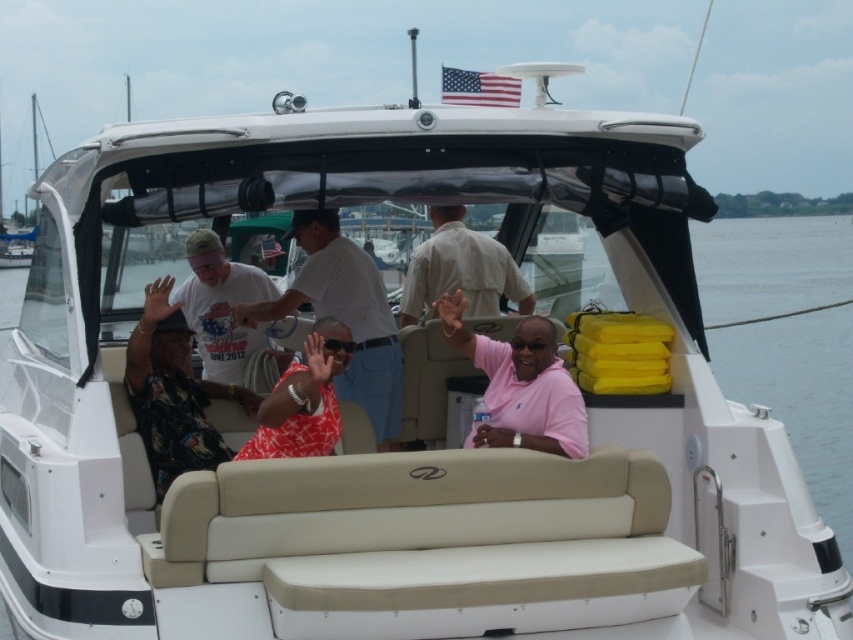
Can you confirm if white t-shirt at center is positioned to the left of red printed shirt at center?

Correct, you'll find white t-shirt at center to the left of red printed shirt at center.

What do you see at coordinates (223, 308) in the screenshot? I see `white t-shirt at center` at bounding box center [223, 308].

Find the location of a particular element. The width and height of the screenshot is (853, 640). white t-shirt at center is located at coordinates (223, 308).

Is printed fabric shirt at left smaller than white t-shirt at center?

Actually, printed fabric shirt at left might be larger than white t-shirt at center.

Find the location of a particular element. This screenshot has width=853, height=640. printed fabric shirt at left is located at coordinates (173, 392).

Who is more forward, (160, 305) or (218, 284)?

Point (160, 305)

Identify the location of printed fabric shirt at left. (173, 392).

From the picture: Is yellow foam at right smaller than white cotton shirt at center?

Incorrect, yellow foam at right is not smaller in size than white cotton shirt at center.

Is yellow foam at right thinner than white cotton shirt at center?

In fact, yellow foam at right might be wider than white cotton shirt at center.

Locate an element on the screen. This screenshot has width=853, height=640. yellow foam at right is located at coordinates (801, 397).

This screenshot has height=640, width=853. I want to click on yellow foam at right, so click(801, 397).